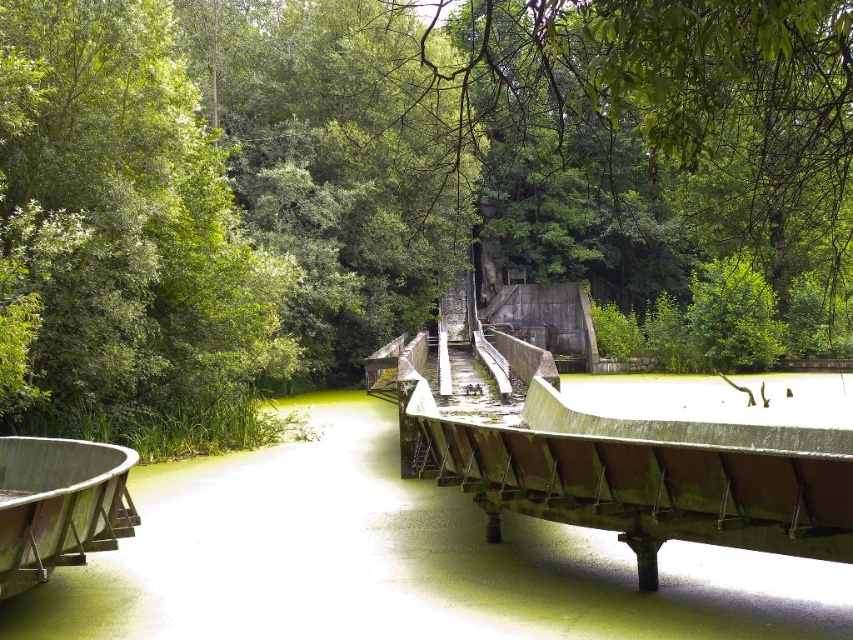
Question: Is green leafy tree at left wider than wooden boat at lower left?

Choices:
 (A) no
 (B) yes

Answer: (B)

Question: Which of the following is the closest to the observer?

Choices:
 (A) (62, 554)
 (B) (82, 108)
 (C) (312, 413)

Answer: (A)

Question: Can you confirm if green leafy tree at left is positioned to the left of wooden boat at lower left?

Choices:
 (A) no
 (B) yes

Answer: (B)

Question: Based on their relative distances, which object is nearer to the green algae-covered water at center?

Choices:
 (A) green leafy tree at left
 (B) wooden boat at lower left

Answer: (B)

Question: In this image, where is green leafy tree at left located relative to wooden boat at lower left?

Choices:
 (A) below
 (B) above

Answer: (B)

Question: Among these points, which one is nearest to the camera?

Choices:
 (A) (45, 552)
 (B) (251, 381)

Answer: (A)